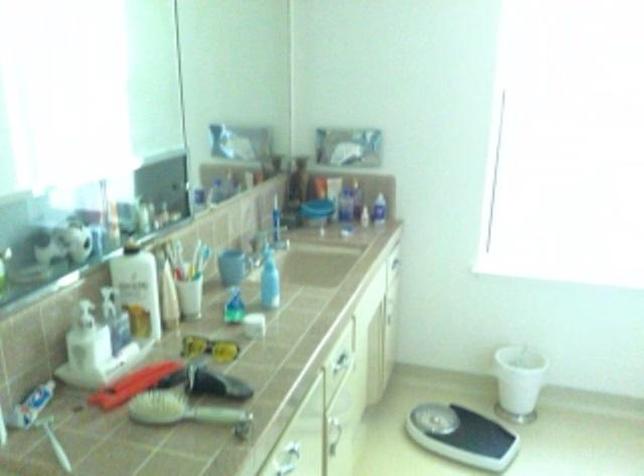
Where would you squeez the white lotion bottle? Please return your answer as a coordinate pair (x, y).

(87, 339)